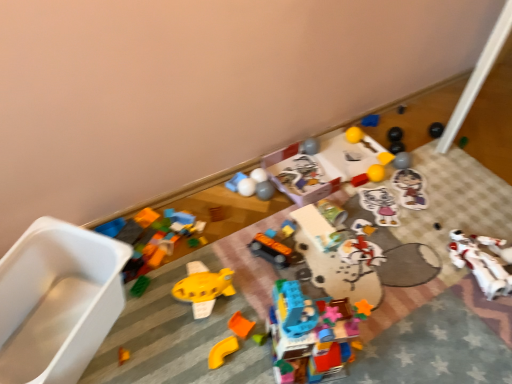
This screenshot has width=512, height=384. Find the location of `free point behind white plastic robot at lower right, which appears as the seventeenth toy when viewed from the left`. free point behind white plastic robot at lower right, which appears as the seventeenth toy when viewed from the left is located at coordinates (471, 213).